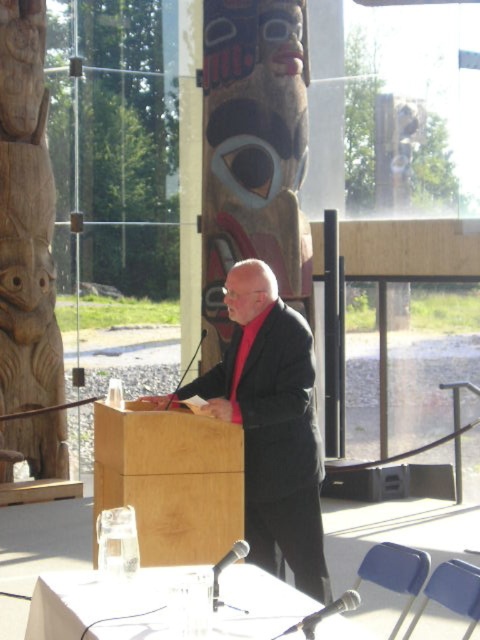
You are an event organizer who needs to set up a microphone stand between the dark gray suit at center and the wooden totem pole at left. Which object should the stand be placed closer to if it needs to be closer to the smaller object?

The dark gray suit at center is smaller than the wooden totem pole at left, so the microphone stand should be placed closer to the dark gray suit at center.

You are an event planner setting up a presentation space. You need to position a new speaker stand so it is in front of the wooden totem pole at left but not blocking the light wood podium at center. Where should you place the speaker stand?

The light wood podium at center is behind the wooden totem pole at left, so placing the speaker stand in front of the wooden totem pole at left would not block the podium. Position it in front of the wooden totem pole at left.